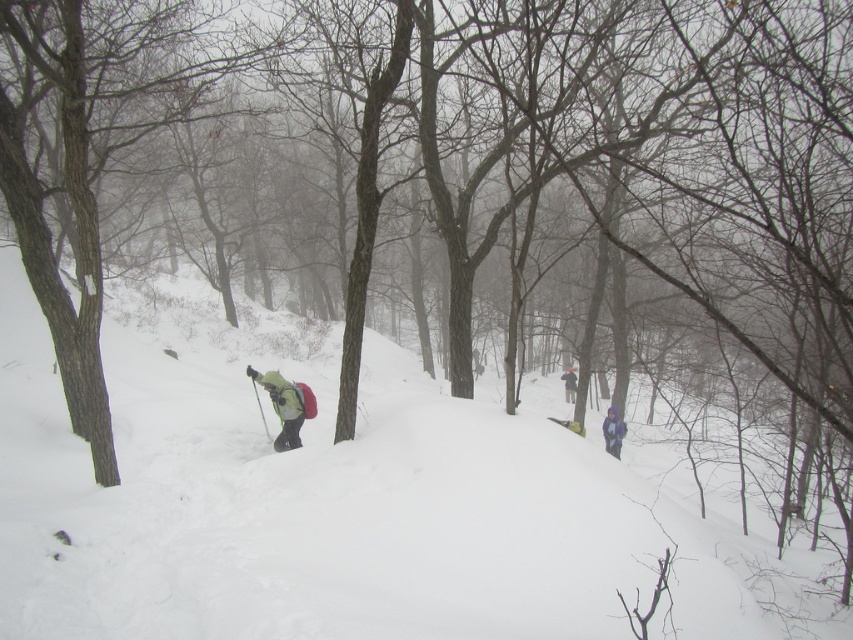
You are standing in the snowy forest and see the white fluffy snow at center and the green matte jacket at center. Which object takes up more space in the scene?

The white fluffy snow at center is bigger than the green matte jacket at center, so it takes up more space in the scene.

You are standing in the snowy forest and see a point marked at coordinates (343, 502). Based on the scene description, what is the color of the surface where this point is located?

The point is on white fluffy snow at center, so the color is white.